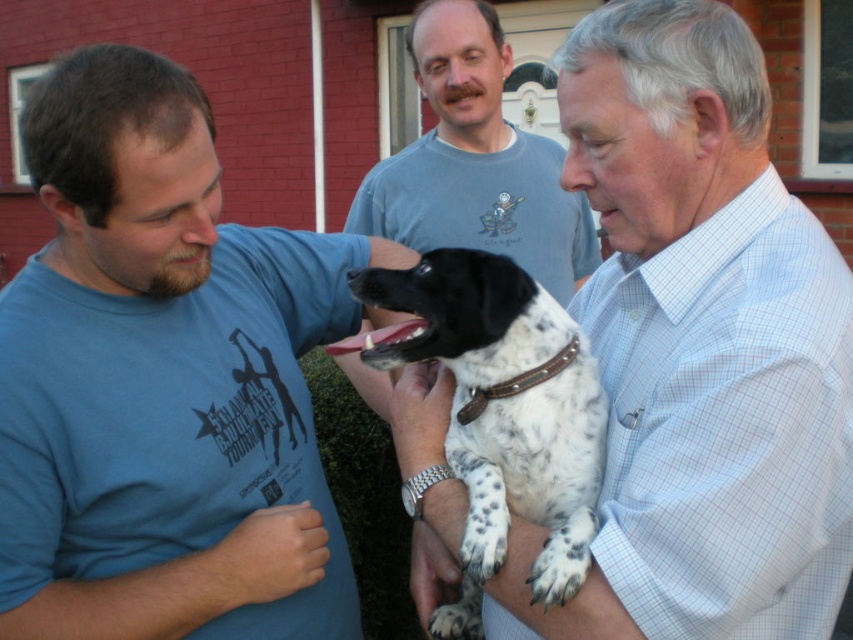
You are a photographer trying to capture the spotted fur dog at center and the white checkered shirt at upper right in the same frame. Which object should you focus on first to ensure both are in the frame?

The white checkered shirt at upper right is located above the spotted fur dog at center, so you should focus on the spotted fur dog at center first to ensure both are in the frame.

You are standing in front of the man in the blue T shirt holding the dog. There are two points marked on the image, one at coordinate point (103, 486) and another at point (479, 493). Which of these points is closer to you?

Point (103, 486) is closer to you than point (479, 493).